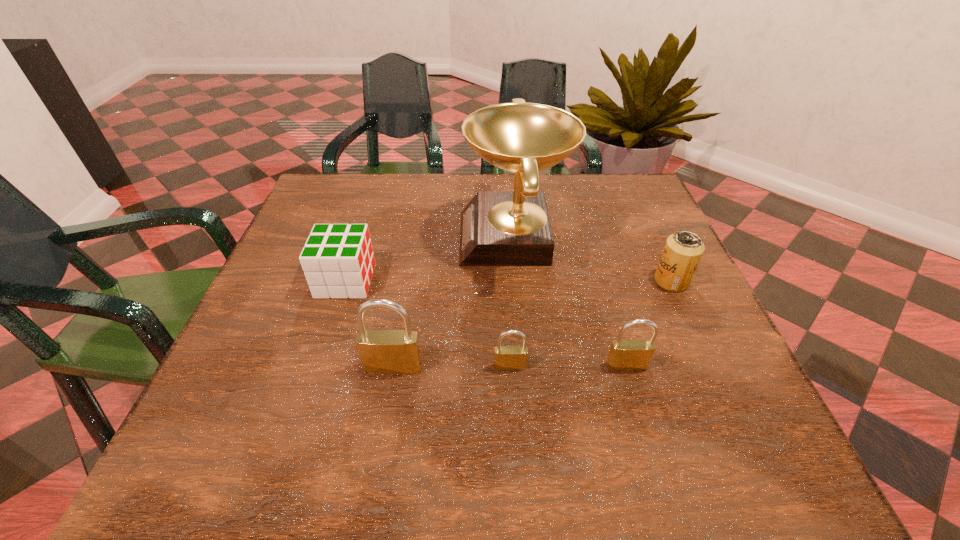
In order to click on vacant area situated on the front-facing side of the tallest object in this screenshot , I will do `click(436, 238)`.

Locate an element on the screen. The image size is (960, 540). vacant space located on the front-facing side of the tallest object is located at coordinates (317, 238).

This screenshot has height=540, width=960. Identify the location of free space located 0.390m on the red face of the cube. (549, 281).

Identify the location of vacant point located 0.240m on the left of the beer can. This screenshot has width=960, height=540. (545, 281).

Where is `object located in the far edge section of the desktop`? The image size is (960, 540). object located in the far edge section of the desktop is located at coordinates (498, 228).

Identify the location of object positioned at the left edge. (338, 261).

You are a GUI agent. You are given a task and a screenshot of the screen. Output one action in this format:
    pyautogui.click(x=<x>, y=<y>)
    Task: Click on the padlock that is at the right edge
    The image size is (960, 540).
    Given the screenshot: What is the action you would take?
    pyautogui.click(x=625, y=355)

Where is `beer can present at the right edge`? This screenshot has width=960, height=540. beer can present at the right edge is located at coordinates (683, 250).

What are the coordinates of `object that is positioned at the near right corner` in the screenshot? It's located at (625, 355).

Where is `vacant space at the far edge of the desktop`? vacant space at the far edge of the desktop is located at coordinates (484, 183).